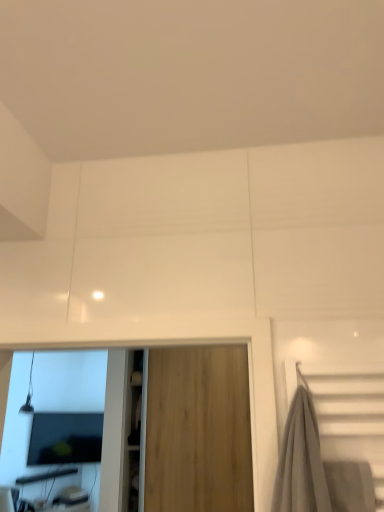
What do you see at coordinates (198, 430) in the screenshot? The width and height of the screenshot is (384, 512). I see `wooden door at center` at bounding box center [198, 430].

The image size is (384, 512). What are the coordinates of `wooden door at center` in the screenshot? It's located at (198, 430).

Find the location of a particular element. The height and width of the screenshot is (512, 384). matte black monitor at lower left is located at coordinates pyautogui.click(x=65, y=438).

This screenshot has height=512, width=384. What do you see at coordinates (65, 438) in the screenshot?
I see `matte black monitor at lower left` at bounding box center [65, 438].

This screenshot has width=384, height=512. I want to click on wooden door at center, so click(198, 430).

Between matte black monitor at lower left and wooden door at center, which one appears on the left side from the viewer's perspective?

matte black monitor at lower left.

From the picture: Between matte black monitor at lower left and wooden door at center, which one is positioned in front?

wooden door at center is more forward.

Does point (86, 459) appear closer or farther from the camera than point (211, 403)?

Clearly, point (86, 459) is more distant from the camera than point (211, 403).

From the image's perspective, which one is positioned higher, matte black monitor at lower left or wooden door at center?

wooden door at center.

From a real-world perspective, does matte black monitor at lower left sit lower than wooden door at center?

Yes, from a real-world perspective, matte black monitor at lower left is under wooden door at center.

Is matte black monitor at lower left thinner than wooden door at center?

Yes, matte black monitor at lower left is thinner than wooden door at center.

Does matte black monitor at lower left have a greater height compared to wooden door at center?

In fact, matte black monitor at lower left may be shorter than wooden door at center.

Who is bigger, matte black monitor at lower left or wooden door at center?

Bigger between the two is wooden door at center.

Is wooden door at center located within matte black monitor at lower left?

Definitely not — wooden door at center is not inside matte black monitor at lower left.

Is matte black monitor at lower left placed right next to wooden door at center?

matte black monitor at lower left and wooden door at center are clearly separated.

Consider the image. Is matte black monitor at lower left looking in the opposite direction of wooden door at center?

matte black monitor at lower left is not turned away from wooden door at center.

How different are the orientations of matte black monitor at lower left and wooden door at center in degrees?

There is a 35.5-degree angle between the facing directions of matte black monitor at lower left and wooden door at center.

The image size is (384, 512). Identify the location of computer monitor below the wooden door at center (from a real-world perspective). pos(65,438).

Considering the relative positions of wooden door at center and matte black monitor at lower left in the image provided, is wooden door at center to the left or to the right of matte black monitor at lower left?

Based on their positions, wooden door at center is located to the right of matte black monitor at lower left.

Between wooden door at center and matte black monitor at lower left, which one is positioned behind?

matte black monitor at lower left is behind.

Considering the points (184, 374) and (49, 424), which point is in front, point (184, 374) or point (49, 424)?

Point (184, 374)

From the image's perspective, would you say wooden door at center is positioned over matte black monitor at lower left?

Indeed, from the image's perspective, wooden door at center is shown above matte black monitor at lower left.

Consider the image. From a real-world perspective, is wooden door at center positioned above or below matte black monitor at lower left?

wooden door at center is above matte black monitor at lower left.

Between wooden door at center and matte black monitor at lower left, which one has larger width?

wooden door at center is wider.

Is wooden door at center shorter than matte black monitor at lower left?

No.

Which of these two, wooden door at center or matte black monitor at lower left, is bigger?

With larger size is wooden door at center.

Do you think wooden door at center is within matte black monitor at lower left, or outside of it?

wooden door at center lies outside matte black monitor at lower left.

Is wooden door at center in contact with matte black monitor at lower left?

There is a gap between wooden door at center and matte black monitor at lower left.

Could you tell me if wooden door at center is facing matte black monitor at lower left?

No, wooden door at center is not turned towards matte black monitor at lower left.

How many degrees apart are the facing directions of wooden door at center and matte black monitor at lower left?

The angular difference between wooden door at center and matte black monitor at lower left is 35.5 degrees.

How distant is wooden door at center from matte black monitor at lower left?

wooden door at center and matte black monitor at lower left are 3.36 meters apart from each other.

Where is `computer monitor that is below the wooden door at center (from the image's perspective)`? computer monitor that is below the wooden door at center (from the image's perspective) is located at coordinates (65, 438).

Where is `garage door on the right of matte black monitor at lower left`? garage door on the right of matte black monitor at lower left is located at coordinates (198, 430).

Where is `computer monitor behind the wooden door at center`? The image size is (384, 512). computer monitor behind the wooden door at center is located at coordinates (65, 438).